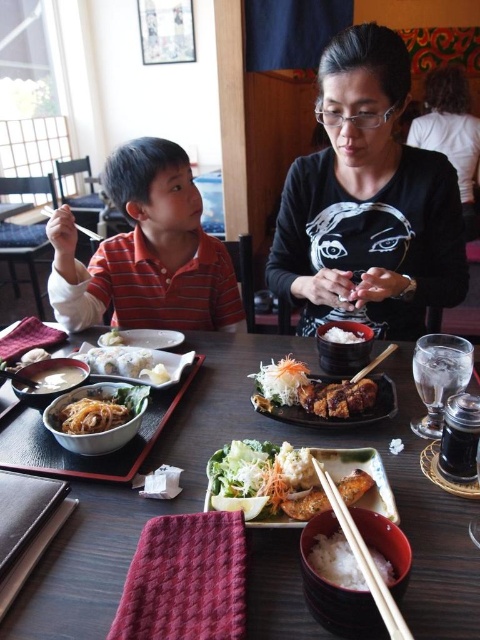
Does golden crispy chicken at center appear under white matte plate at lower left?

Yes, golden crispy chicken at center is below white matte plate at lower left.

Is golden crispy chicken at center further to camera compared to white matte plate at lower left?

No, it is in front of white matte plate at lower left.

The width and height of the screenshot is (480, 640). In order to click on golden crispy chicken at center in this screenshot , I will do `click(305, 504)`.

Can you confirm if orange striped polo shirt at left is wider than grilled chicken skewers at center?

Yes.

Does point (197, 282) come farther from viewer compared to point (338, 381)?

That is True.

Describe the element at coordinates (145, 252) in the screenshot. I see `orange striped polo shirt at left` at that location.

What are the coordinates of `orange striped polo shirt at left` in the screenshot? It's located at (145, 252).

Which is above, grilled chicken skewers at center or white matte rice at center?

grilled chicken skewers at center is higher up.

Between grilled chicken skewers at center and white matte rice at center, which one is positioned lower?

white matte rice at center is below.

Locate an element on the screen. This screenshot has width=480, height=640. grilled chicken skewers at center is located at coordinates (x=311, y=390).